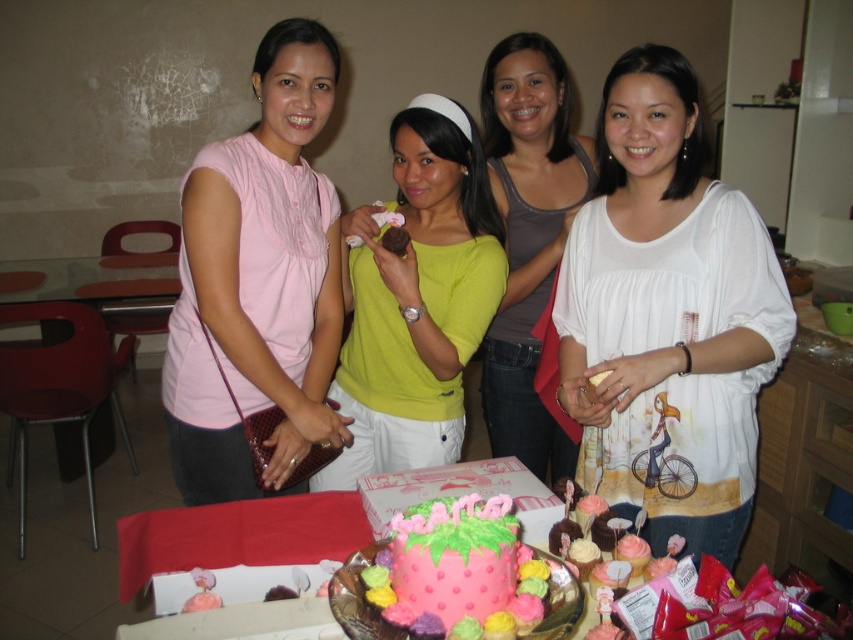
Question: Can you confirm if pink fabric shirt at left is positioned below matte white blouse at center?

Choices:
 (A) no
 (B) yes

Answer: (A)

Question: Observing the image, what is the correct spatial positioning of pink fabric shirt at left in reference to matte yellow shirt at center?

Choices:
 (A) right
 (B) left

Answer: (B)

Question: Does pink fabric shirt at left have a smaller size compared to glasstransparenttable at left?

Choices:
 (A) no
 (B) yes

Answer: (B)

Question: Which of the following is the farthest from the observer?

Choices:
 (A) matte yellow shirt at center
 (B) pink fabric shirt at left

Answer: (A)

Question: Which of the following is the farthest from the observer?

Choices:
 (A) pink frosted cake at center
 (B) matte white blouse at center

Answer: (B)

Question: Estimate the real-world distances between objects in this image. Which object is closer to the matte yellow shirt at center?

Choices:
 (A) matte white blouse at center
 (B) pink fabric shirt at left
 (C) glasstransparenttable at left
 (D) pink frosted cake at center

Answer: (B)